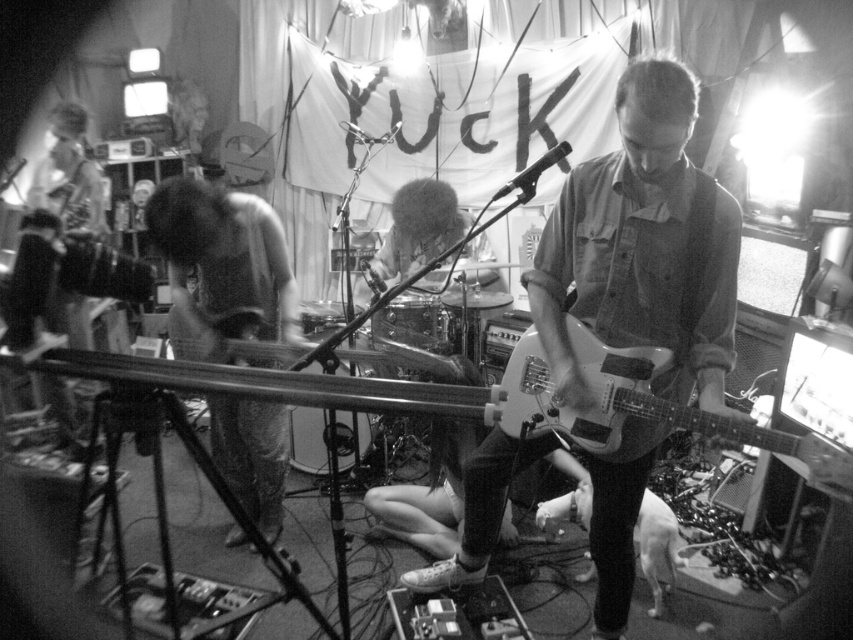
Is point (521, 464) behind point (44, 198)?

No, it is not.

In the scene shown: Measure the distance between point (636, 451) and camera.

The distance of point (636, 451) from camera is 5.96 feet.

You are a GUI agent. You are given a task and a screenshot of the screen. Output one action in this format:
    pyautogui.click(x=<x>, y=<y>)
    Task: Click on the matte white guitar at center
    The image size is (853, 640).
    Given the screenshot: What is the action you would take?
    pyautogui.click(x=642, y=248)

Is point (270, 314) closer to camera compared to point (84, 157)?

Yes.

Does denim pants at left have a lesser width compared to matte black guitar at left?

Correct, denim pants at left's width is less than matte black guitar at left's.

Does point (256, 292) come closer to viewer compared to point (96, 205)?

That is True.

Where is `denim pants at left`? denim pants at left is located at coordinates (222, 259).

Can you confirm if matte white guitar at center is taller than denim pants at left?

Yes, matte white guitar at center is taller than denim pants at left.

Who is positioned more to the right, matte white guitar at center or denim pants at left?

From the viewer's perspective, matte white guitar at center appears more on the right side.

Is point (637, 454) in front of point (210, 275)?

Yes.

Locate an element on the screen. matte white guitar at center is located at coordinates (642, 248).